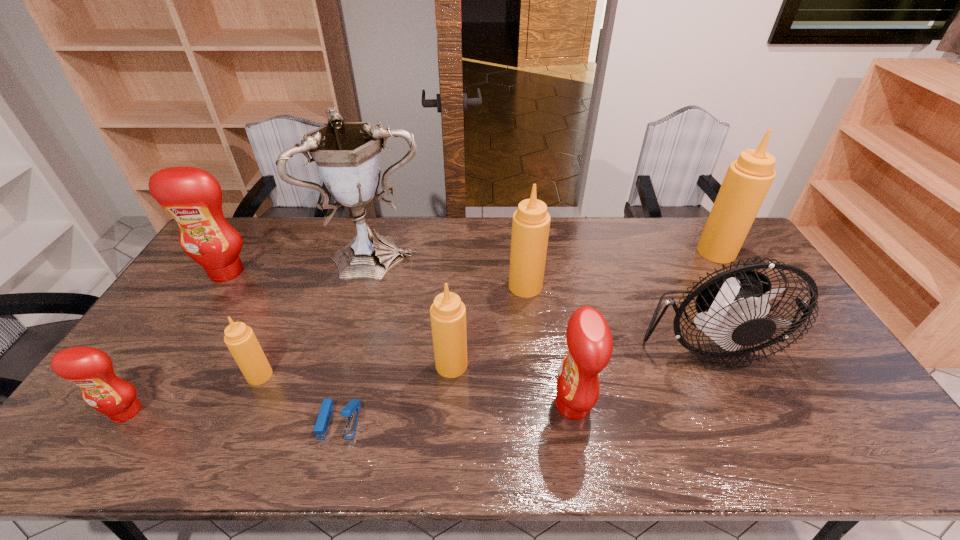
The image size is (960, 540). I want to click on tan condiment object that ranks as the third closest to the shortest object, so tap(531, 222).

Image resolution: width=960 pixels, height=540 pixels. In order to click on red condiment that is the third nearest to the gray trophy cup in this screenshot , I will do (x=589, y=339).

Identify which red condiment is the third nearest to the fan. Please provide its 2D coordinates. Your answer should be formatted as a tuple, i.e. [(x, y)], where the tuple contains the x and y coordinates of a point satisfying the conditions above.

[(91, 369)]

The width and height of the screenshot is (960, 540). Identify the location of vacant space that satisfies the following two spatial constraints: 1. on the back side of the second smallest tan condiment; 2. on the left side of the third object from left to right. (264, 365).

This screenshot has width=960, height=540. What are the coordinates of `free point that satisfies the following two spatial constraints: 1. in front of the black fan, directing airflow; 2. on the label side of the second biggest red condiment` in the screenshot? It's located at (740, 405).

Locate an element on the screen. Image resolution: width=960 pixels, height=540 pixels. free space that satisfies the following two spatial constraints: 1. on the label side of the farthest red condiment; 2. on the left side of the shortest object is located at coordinates (131, 421).

Locate an element on the screen. vacant area in the image that satisfies the following two spatial constraints: 1. on the label side of the biggest red condiment; 2. on the left side of the third nearest tan condiment is located at coordinates (218, 286).